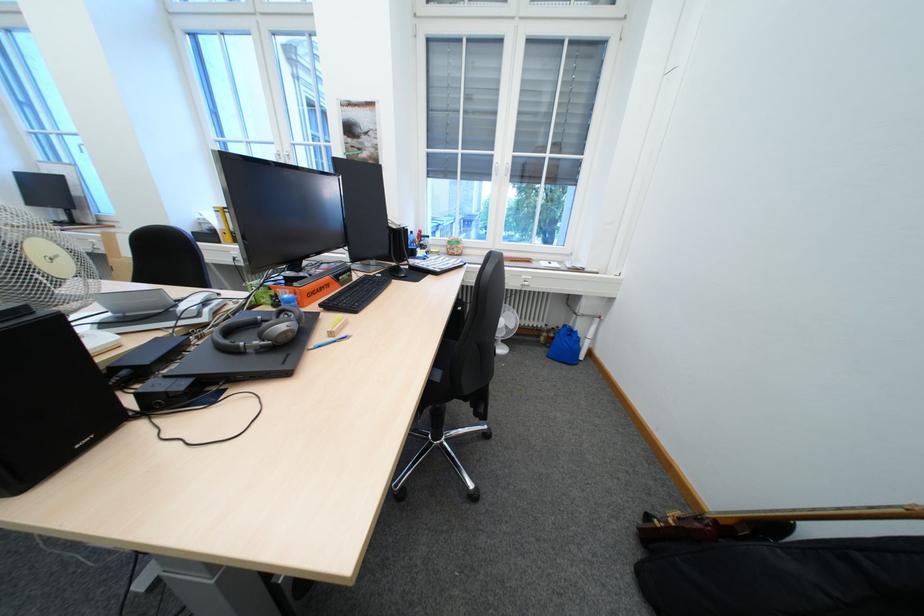
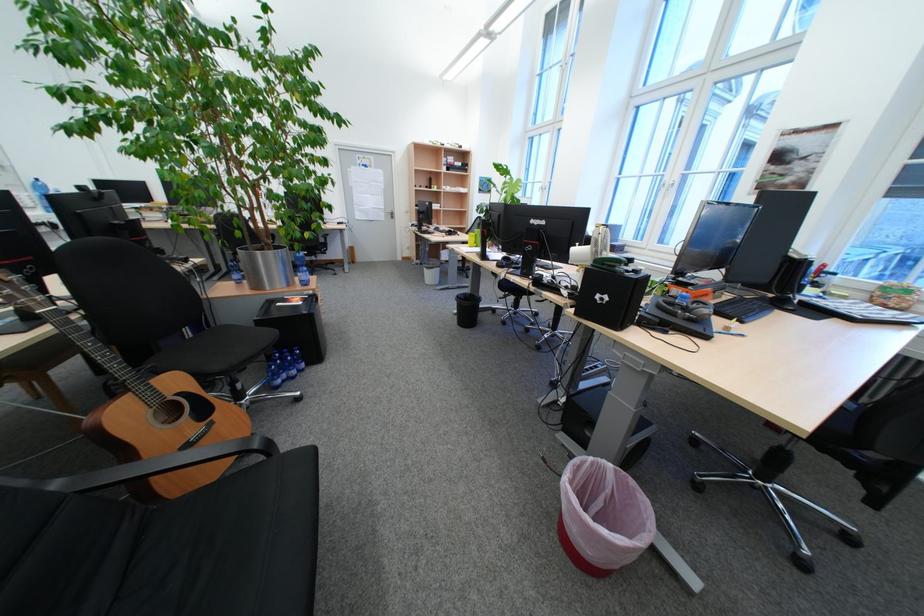
Locate, in the second image, the point that corresponds to [406,265] in the first image.

(783, 297)